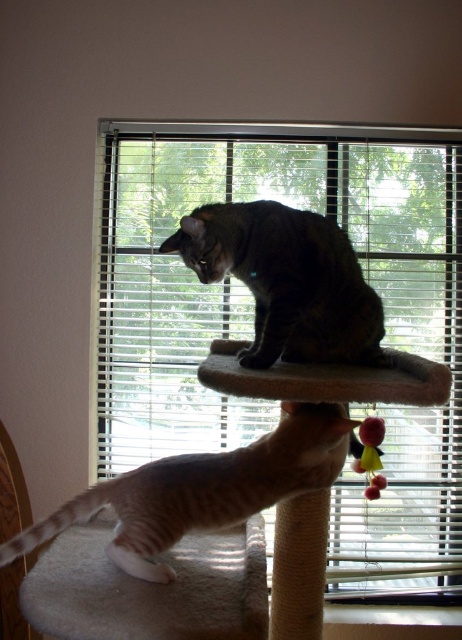
You are a cat trying to jump from the point at coordinates point (443, 426) to the point at coordinates point (312, 408). Can you reach the second point without falling?

Point point (443, 426) is further to the viewer than point point (312, 408), so the cat can reach the second point without falling because it is closer to the cat.

You are standing in the room and want to place a small toy on the beige carpeted stool at center. If your arm can reach 3.5 feet, can you reach the stool without moving closer?

The distance between you and the beige carpeted stool at center is 4.31 feet, which is farther than your arm can reach. You would need to move closer to place the toy.